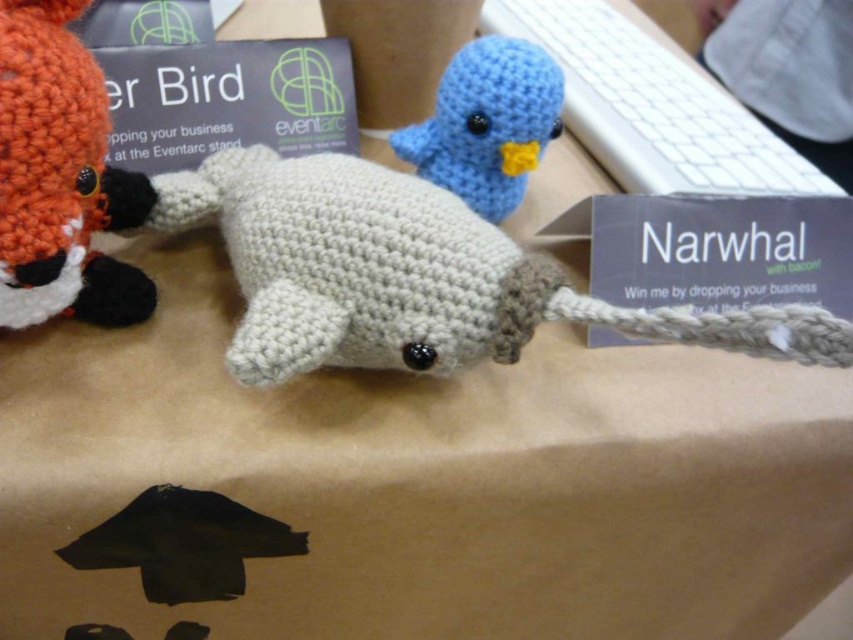
You are organizing a display of handmade stuffed animals and need to place a new item between the white yarn narwhal at center and another object. Which object is the narwhal positioned closest to?

The white yarn narwhal at center is positioned closest to the orange and black crocheted fox to its left since it is directly to the left of the narwhal.

You are standing in front of a table displaying handmade stuffed animals. There is a light gray crocheted narwhal at the center, a small orange and black crocheted fox to its left, and a blue crocheted bird with a yellow beak behind them. A point at coordinate (12, 145) is part of one of these items. If you want to touch this point, which stuffed animal should you reach for?

The point at coordinate (12, 145) is 32.69 inches away from the camera. Since the camera view shows the light gray crocheted narwhal at the center, the orange and black crocheted fox to its left, and the blue crocheted bird behind them, the closest item to the camera would be the light gray crocheted narwhal. Therefore, to touch the point, you should reach for the light gray crocheted narwhal.